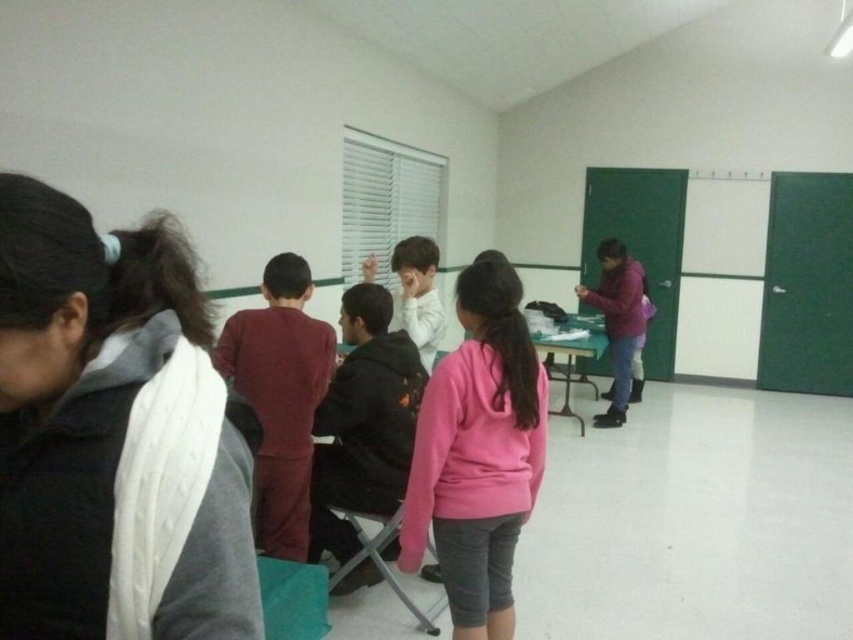
Can you confirm if pink fleece sweatshirt at center is positioned above purple fleece jacket at right?

Actually, pink fleece sweatshirt at center is below purple fleece jacket at right.

Is point (492, 563) more distant than point (625, 332)?

No, it is in front of (625, 332).

This screenshot has height=640, width=853. Find the location of `pink fleece sweatshirt at center`. pink fleece sweatshirt at center is located at coordinates (479, 452).

Does pink fleece sweatshirt at center appear on the left side of white matte shirt at center?

In fact, pink fleece sweatshirt at center is to the right of white matte shirt at center.

Is pink fleece sweatshirt at center to the right of white matte shirt at center from the viewer's perspective?

Yes, pink fleece sweatshirt at center is to the right of white matte shirt at center.

Which is behind, point (461, 387) or point (416, 337)?

Point (416, 337)

You are a GUI agent. You are given a task and a screenshot of the screen. Output one action in this format:
    pyautogui.click(x=<x>, y=<y>)
    Task: Click on the pink fleece sweatshirt at center
    This screenshot has height=640, width=853.
    Given the screenshot: What is the action you would take?
    pyautogui.click(x=479, y=452)

Between white knitted scarf at left and white matte shirt at center, which one appears on the left side from the viewer's perspective?

Positioned to the left is white knitted scarf at left.

Looking at this image, between white knitted scarf at left and white matte shirt at center, which one is positioned lower?

Positioned lower is white knitted scarf at left.

Is point (61, 301) closer to camera compared to point (430, 355)?

Yes.

At what (x,y) coordinates should I click in order to perform the action: click on white knitted scarf at left. Please return your answer as a coordinate pair (x, y). This screenshot has height=640, width=853. Looking at the image, I should click on (113, 435).